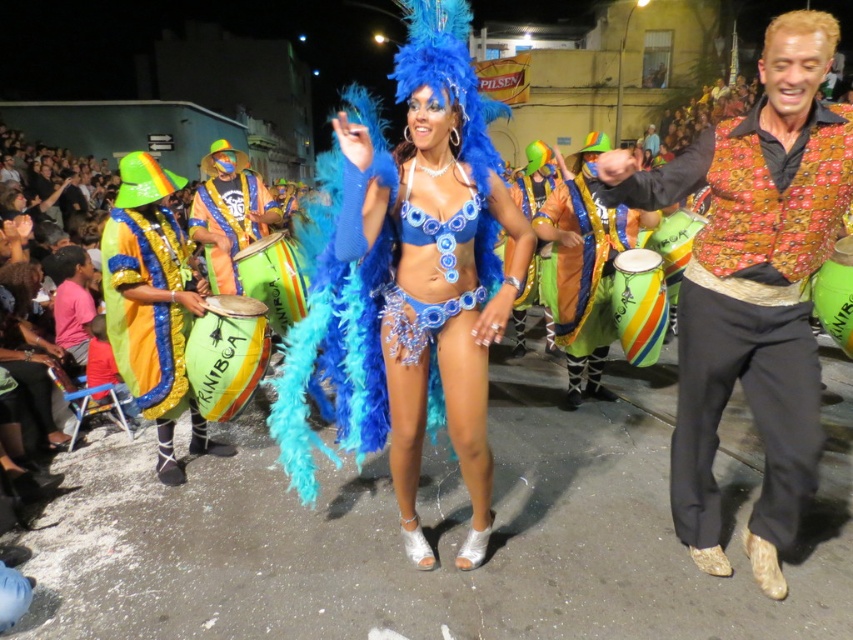
You are a street performer who wants to place a new drum between the multicolored fabric drum at right and the green rubber drum at center. Based on their positions, where should you place the new drum?

The multicolored fabric drum at right is positioned under the green rubber drum at center, so placing the new drum between them would require positioning it above the multicolored fabric drum at right and below the green rubber drum at center.